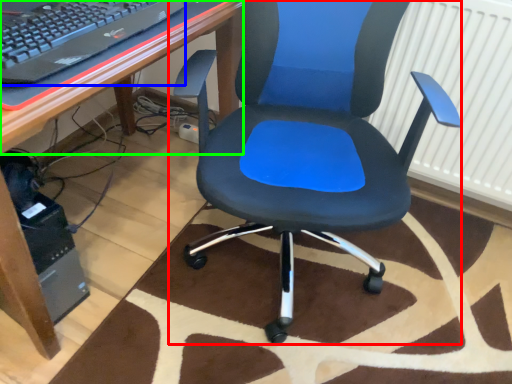
Question: Which object is the farthest from chair (highlighted by a red box)? Choose among these: computer keyboard (highlighted by a blue box) or computer desk (highlighted by a green box).

Choices:
 (A) computer keyboard
 (B) computer desk

Answer: (A)